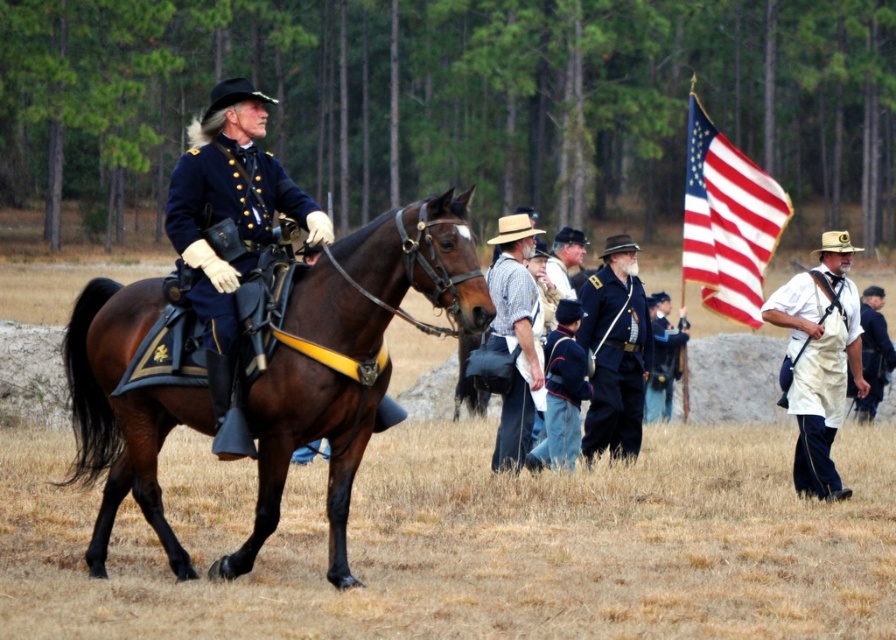
Question: Among these objects, which one is farthest from the camera?

Choices:
 (A) blue cotton shirt at center
 (B) dark blue fabric uniform at center

Answer: (A)

Question: Which point is farther to the camera?

Choices:
 (A) (294, 384)
 (B) (765, 188)
 (C) (531, 394)
 (D) (612, 243)

Answer: (B)

Question: From the image, what is the correct spatial relationship of blue cotton shirt at center in relation to dark blue fabric uniform at center?

Choices:
 (A) right
 (B) left

Answer: (A)

Question: In this image, where is white cotton overalls at right located relative to blue cotton shirt at center?

Choices:
 (A) above
 (B) below

Answer: (B)

Question: Which point appears farthest from the camera in this image?

Choices:
 (A) (320, 237)
 (B) (380, 262)
 (C) (862, 397)

Answer: (C)

Question: Is white cotton overalls at right to the right of blue wool jacket at center from the viewer's perspective?

Choices:
 (A) yes
 (B) no

Answer: (A)